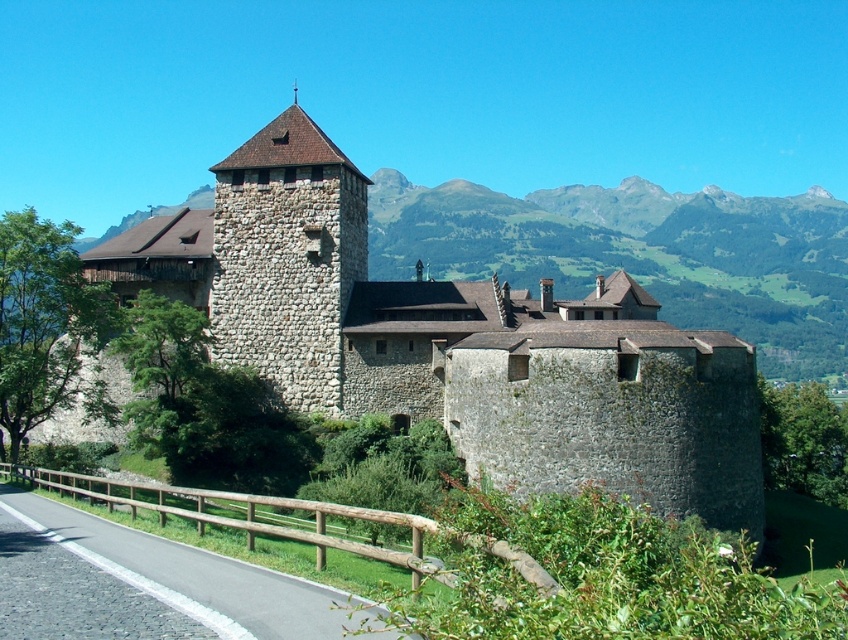
Based on the photo, does stone wall at center come behind stone tower at center?

No, it is in front of stone tower at center.

Between point (607, 344) and point (244, 147), which one is positioned in front?

Point (607, 344)

The width and height of the screenshot is (848, 640). What are the coordinates of `stone wall at center` in the screenshot? It's located at (450, 340).